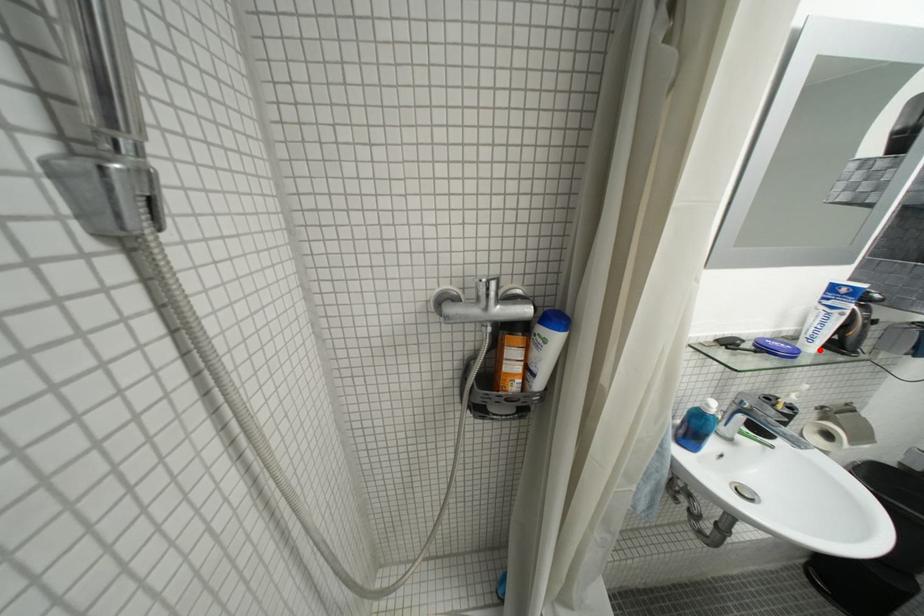
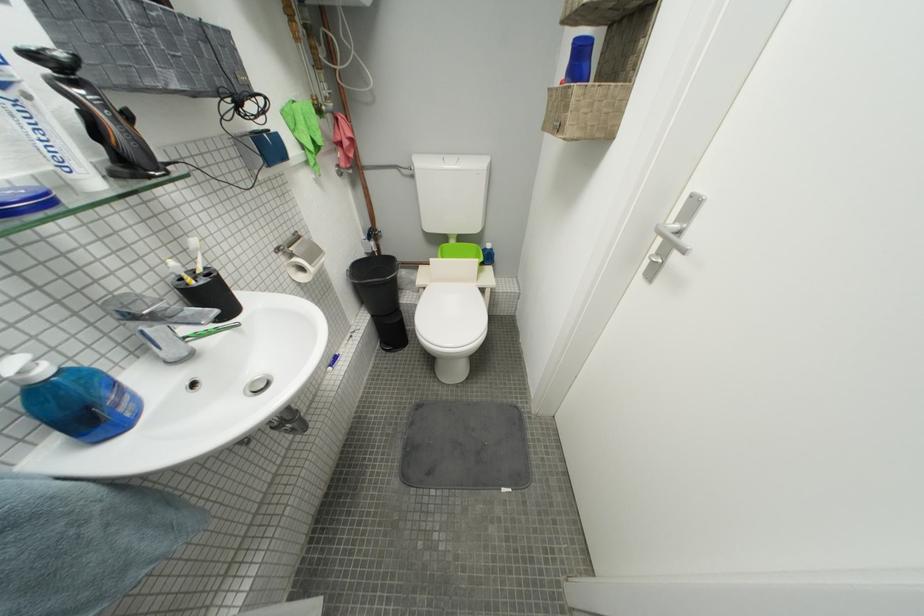
The point at the highlighted location is marked in the first image. Where is the corresponding point in the second image?

(103, 185)